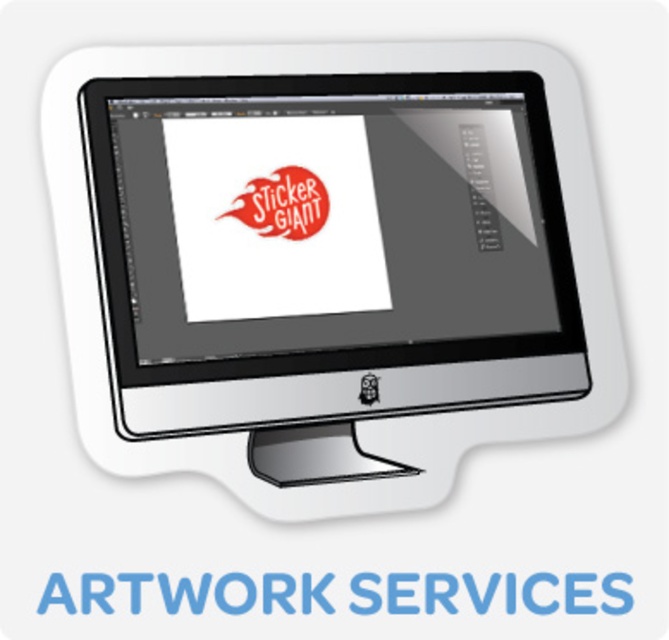
Question: Considering the relative positions of white glossy desktop computer at center and white matte sticker at center in the image provided, where is white glossy desktop computer at center located with respect to white matte sticker at center?

Choices:
 (A) below
 (B) above

Answer: (B)

Question: Which of the following is the closest to the observer?

Choices:
 (A) flame red sticker at center
 (B) white matte sticker at center
 (C) white glossy desktop computer at center

Answer: (B)

Question: Which is farther from the white glossy desktop computer at center?

Choices:
 (A) flame red sticker at center
 (B) white matte sticker at center

Answer: (B)

Question: From the image, what is the correct spatial relationship of white glossy desktop computer at center in relation to flame red sticker at center?

Choices:
 (A) right
 (B) left

Answer: (A)

Question: Is the position of white matte sticker at center more distant than that of flame red sticker at center?

Choices:
 (A) no
 (B) yes

Answer: (A)

Question: Which point is closer to the camera?

Choices:
 (A) click(302, 214)
 (B) click(577, 604)

Answer: (B)